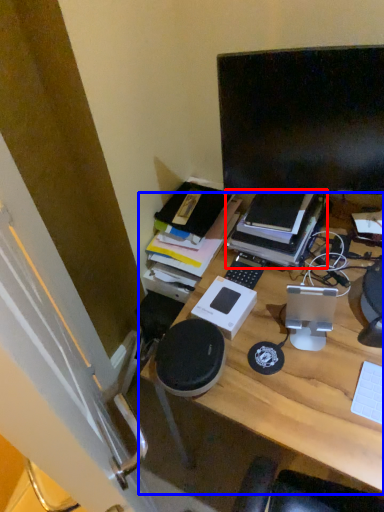
Question: Which of the following is the closest to the observer, book (highlighted by a red box) or desk (highlighted by a blue box)?

Choices:
 (A) book
 (B) desk

Answer: (B)